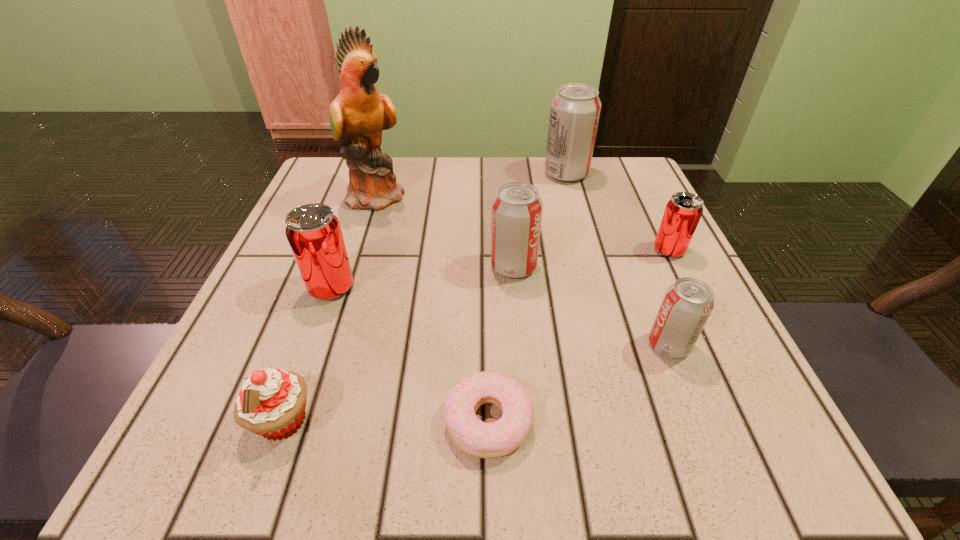
Locate an element on the screen. This screenshot has width=960, height=540. object at the far left corner is located at coordinates (358, 115).

Identify the location of object at the near left corner. (272, 402).

Where is `object at the far right corner`? This screenshot has width=960, height=540. object at the far right corner is located at coordinates (575, 109).

At what (x,y) coordinates should I click in order to perform the action: click on vacant point at the far edge. Please return your answer as a coordinate pair (x, y). Image resolution: width=960 pixels, height=540 pixels. Looking at the image, I should click on (410, 159).

The image size is (960, 540). I want to click on vacant space at the near edge of the desktop, so click(x=410, y=455).

Locate an element on the screen. The height and width of the screenshot is (540, 960). vacant region at the left edge is located at coordinates (281, 354).

In order to click on blank space at the right edge in this screenshot , I will do `click(605, 245)`.

The height and width of the screenshot is (540, 960). What are the coordinates of `free point at the far left corner` in the screenshot? It's located at [x=333, y=187].

Find the location of a particular element. The image size is (960, 540). vacant space at the far right corner is located at coordinates (635, 198).

The height and width of the screenshot is (540, 960). Find the location of `free spot between the second soda can from left to right and the nearest soda can`. free spot between the second soda can from left to right and the nearest soda can is located at coordinates (591, 306).